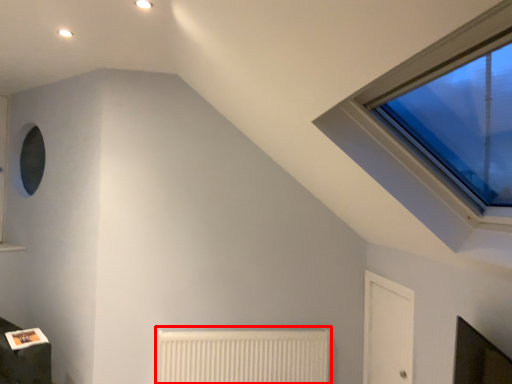
Question: From the image's perspective, what is the correct spatial relationship of radiator (annotated by the red box) in relation to glass door?

Choices:
 (A) above
 (B) below

Answer: (B)